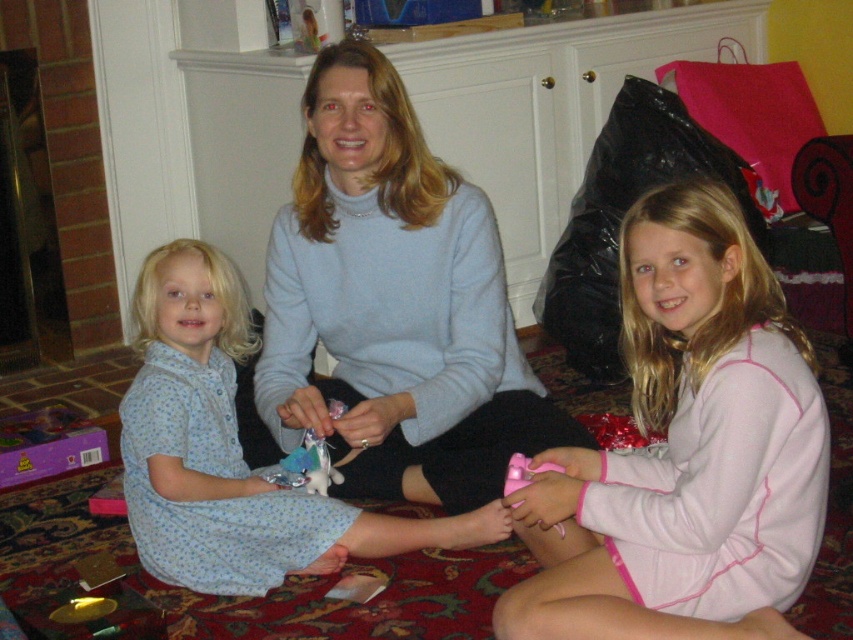
Question: Which object is the closest to the light blue sweater at center?

Choices:
 (A) blue floral dress at left
 (B) shiny metallic toy at center
 (C) pink fleece pajamas at lower right

Answer: (A)

Question: Based on their relative distances, which object is farther from the light blue sweater at center?

Choices:
 (A) shiny metallic toy at center
 (B) blue floral dress at left

Answer: (A)

Question: Is light blue sweater at center positioned before shiny metallic toy at center?

Choices:
 (A) no
 (B) yes

Answer: (B)

Question: Does light blue sweater at center have a greater width compared to blue floral dress at left?

Choices:
 (A) no
 (B) yes

Answer: (A)

Question: Can you confirm if pink fleece pajamas at lower right is positioned below blue floral dress at left?

Choices:
 (A) yes
 (B) no

Answer: (B)

Question: Which is farther from the blue floral dress at left?

Choices:
 (A) shiny metallic toy at center
 (B) light blue sweater at center
 (C) pink fleece pajamas at lower right

Answer: (C)